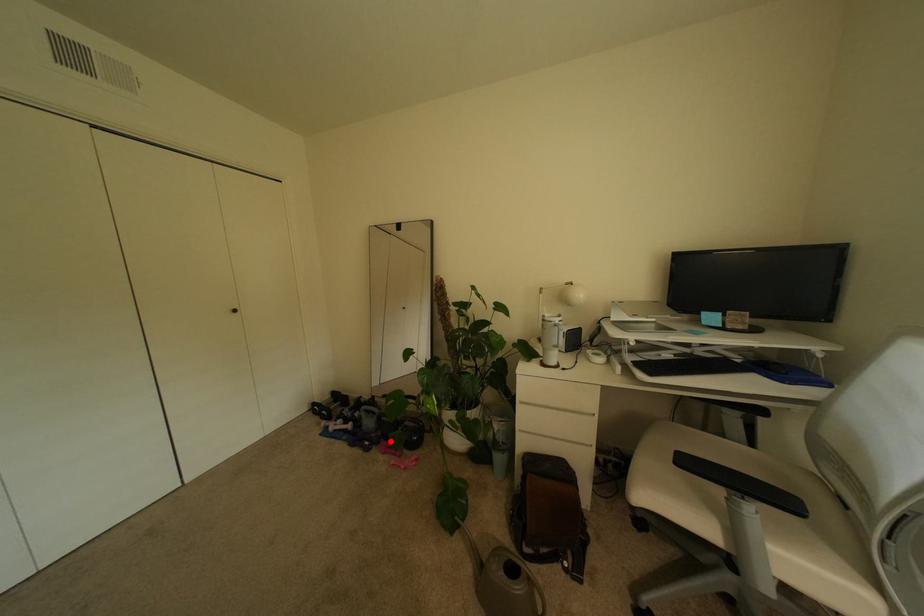
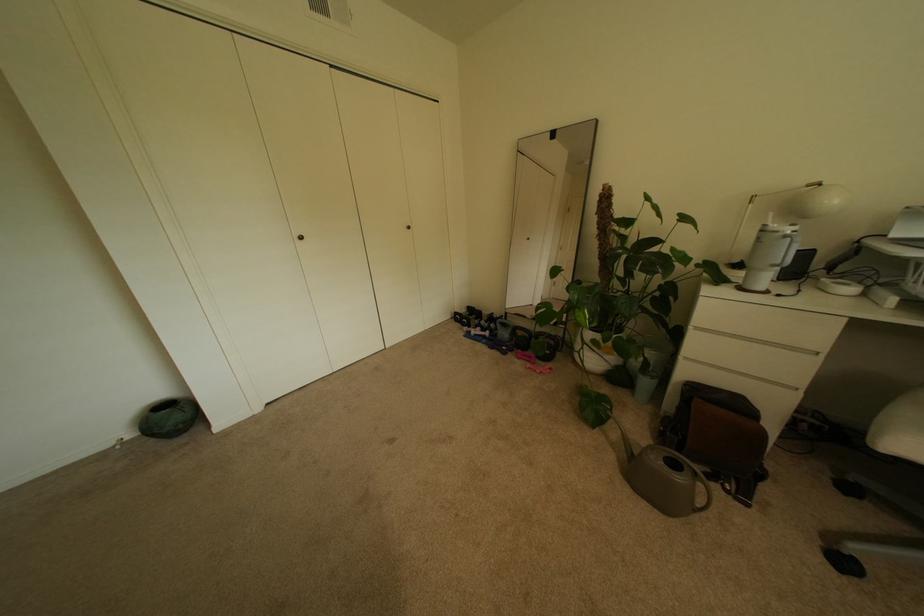
Question: I am providing you with two images of the same scene from different viewpoints. Image1 has a red point marked. In image2, the corresponding 3D location appears at what relative position? Reply with the corresponding letter.

Choices:
 (A) Closer
 (B) Farther

Answer: (A)